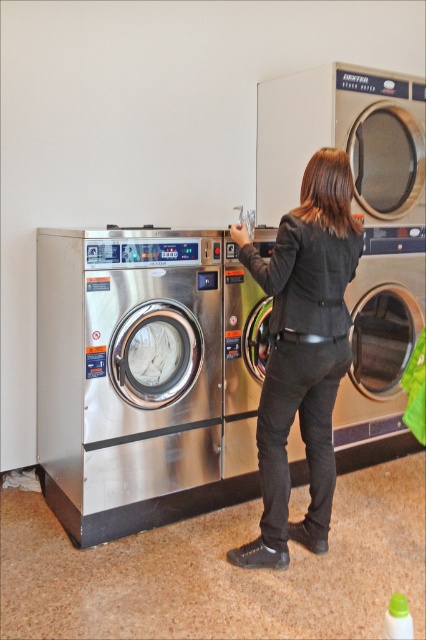
Question: Which of the following is the closest to the observer?

Choices:
 (A) stainless steel washing machine at left
 (B) stainless steel washing machine at center

Answer: (A)

Question: Can you confirm if stainless steel washing machine at left is thinner than black leather jacket at center?

Choices:
 (A) yes
 (B) no

Answer: (B)

Question: Which point is closer to the camera?

Choices:
 (A) (402, 369)
 (B) (198, 364)

Answer: (B)

Question: Can you confirm if stainless steel washing machine at left is smaller than stainless steel washing machine at center?

Choices:
 (A) yes
 (B) no

Answer: (B)

Question: Is stainless steel washing machine at left thinner than black leather jacket at center?

Choices:
 (A) yes
 (B) no

Answer: (B)

Question: Based on their relative distances, which object is farther from the stainless steel washing machine at center?

Choices:
 (A) black leather jacket at center
 (B) stainless steel washing machine at left

Answer: (B)